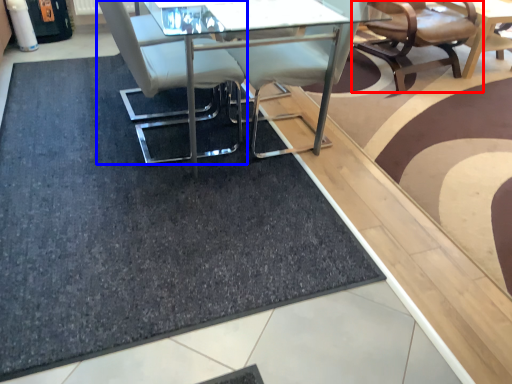
Question: Among these objects, which one is nearest to the camera, chair (highlighted by a red box) or chair (highlighted by a blue box)?

Choices:
 (A) chair
 (B) chair

Answer: (B)